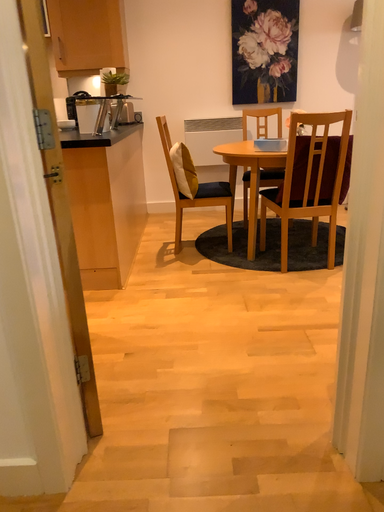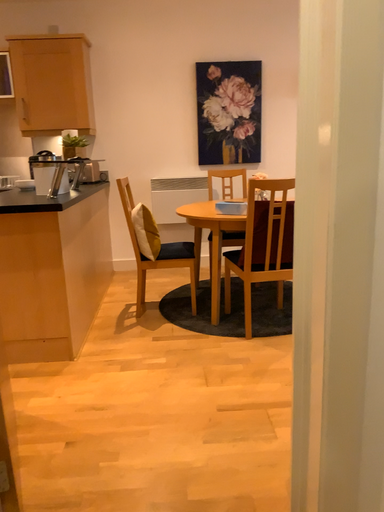
Question: Which way did the camera rotate in the video?

Choices:
 (A) rotated upward
 (B) rotated downward

Answer: (A)